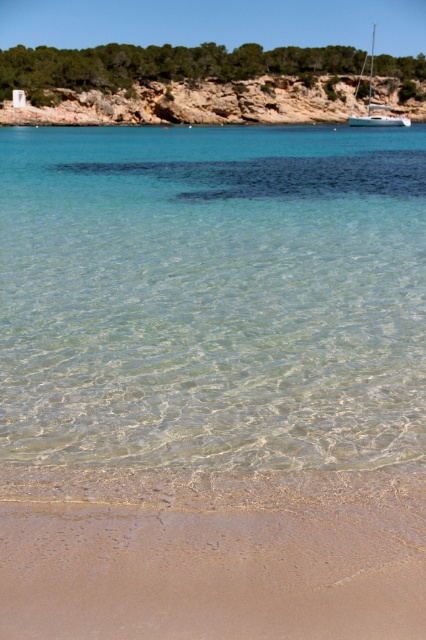
Question: Which object is the closest to the sandy at lower center?

Choices:
 (A) clear water at center
 (B) white glossy sailboat at upper right

Answer: (A)

Question: Is clear water at center wider than sandy at lower center?

Choices:
 (A) yes
 (B) no

Answer: (A)

Question: Can you confirm if sandy at lower center is wider than white glossy sailboat at upper right?

Choices:
 (A) no
 (B) yes

Answer: (A)

Question: Does clear water at center lie in front of sandy at lower center?

Choices:
 (A) yes
 (B) no

Answer: (B)

Question: Which object appears farthest from the camera in this image?

Choices:
 (A) clear water at center
 (B) white glossy sailboat at upper right
 (C) sandy at lower center

Answer: (B)

Question: Which point is farther to the camera?

Choices:
 (A) white glossy sailboat at upper right
 (B) sandy at lower center

Answer: (A)